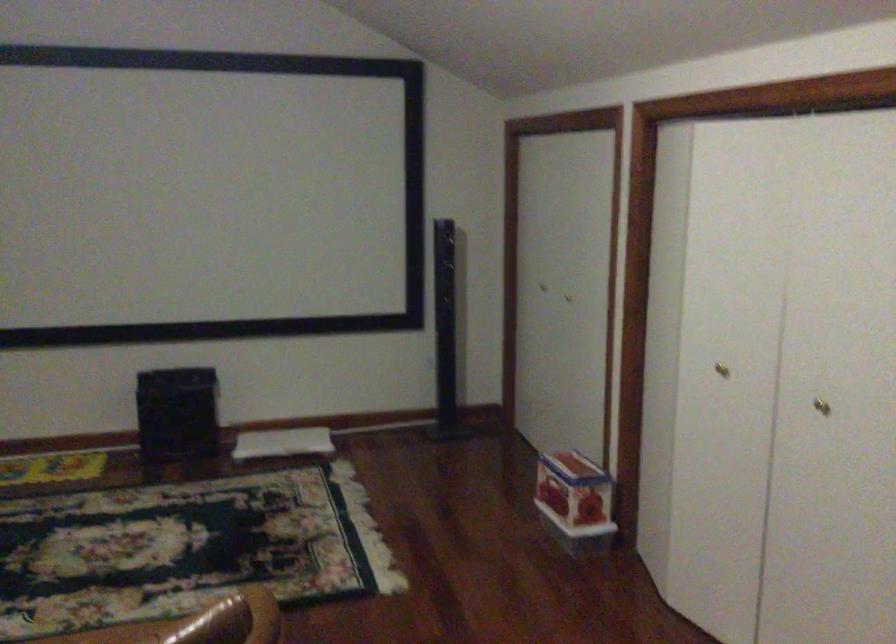
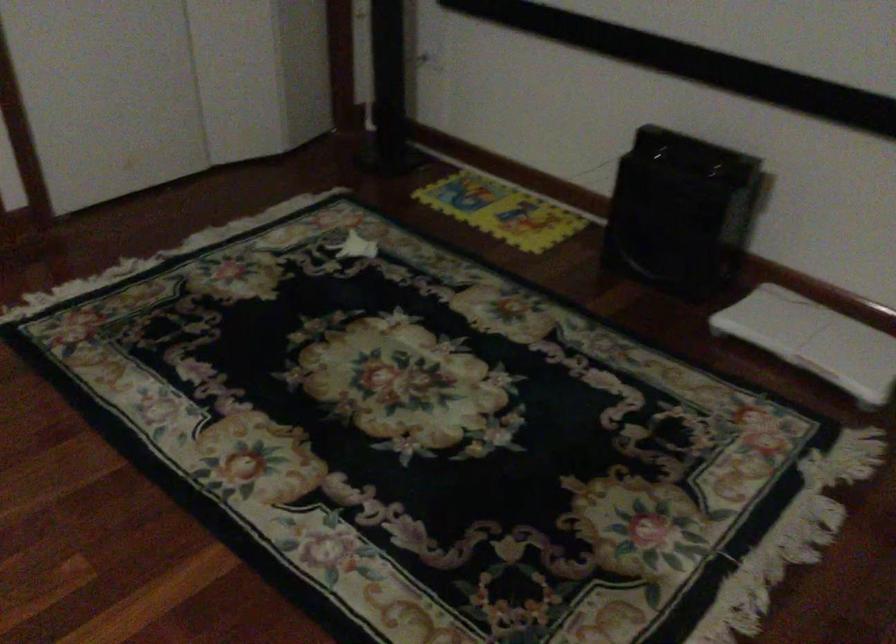
Locate, in the second image, the point that corresponds to pixel 283 438 in the first image.

(814, 339)